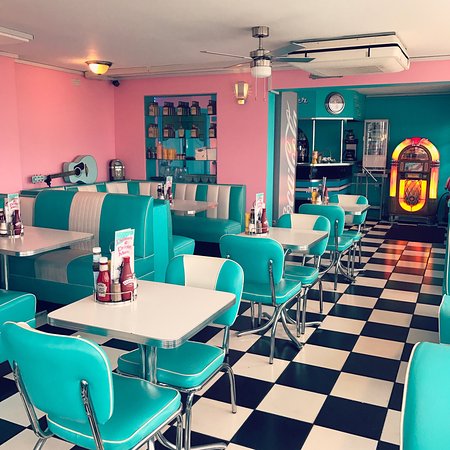
This screenshot has height=450, width=450. I want to click on table, so pos(166,315), pos(286,241), pos(352,210).